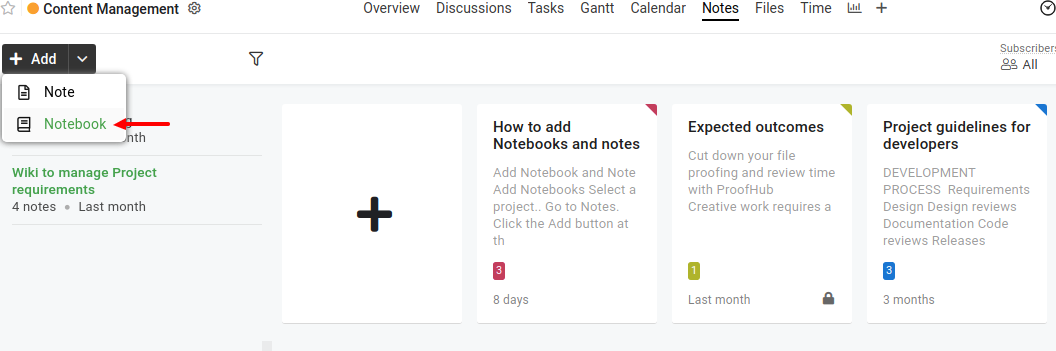
Identify the location of note with green tag. (772, 199).